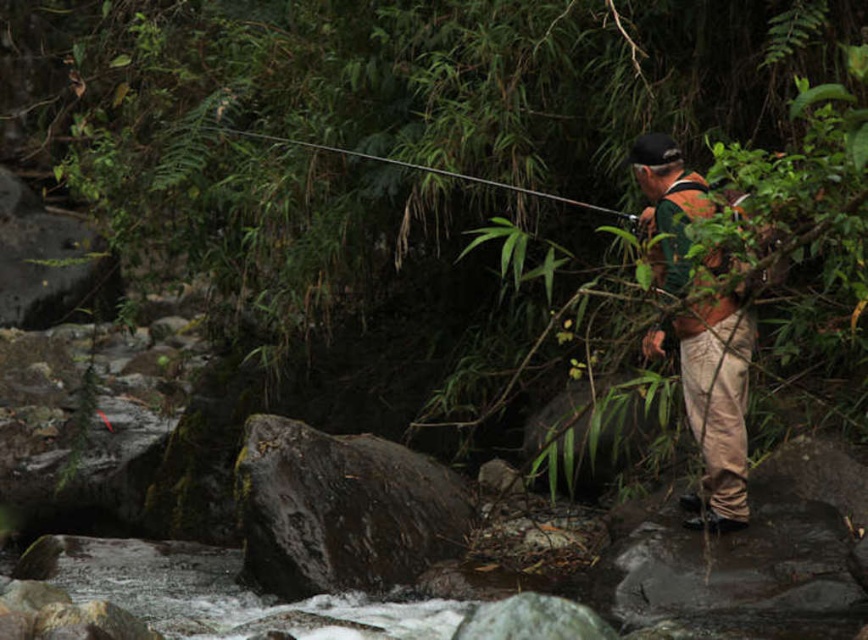
Question: Can you confirm if dark brown rough rock at center is positioned to the right of smooth black rod at upper center?

Choices:
 (A) no
 (B) yes

Answer: (A)

Question: Which point is closer to the camera taking this photo?

Choices:
 (A) (718, 442)
 (B) (531, 193)
 (C) (356, 448)

Answer: (A)

Question: Which object is the farthest from the green fabric shirt at right?

Choices:
 (A) dark brown rough rock at center
 (B) smooth black rod at upper center

Answer: (A)

Question: Can you confirm if dark brown rough rock at center is positioned above smooth black rod at upper center?

Choices:
 (A) yes
 (B) no

Answer: (B)

Question: Is dark brown rough rock at center closer to the viewer compared to smooth black rod at upper center?

Choices:
 (A) no
 (B) yes

Answer: (A)

Question: Which of the following is the closest to the observer?

Choices:
 (A) (721, 422)
 (B) (252, 428)

Answer: (A)